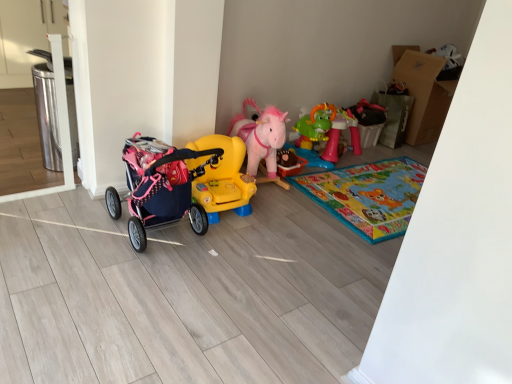
Find the location of `free space in front of pink fabric stroller at left, the 1th toy when ordered from left to right`. free space in front of pink fabric stroller at left, the 1th toy when ordered from left to right is located at coordinates (108, 298).